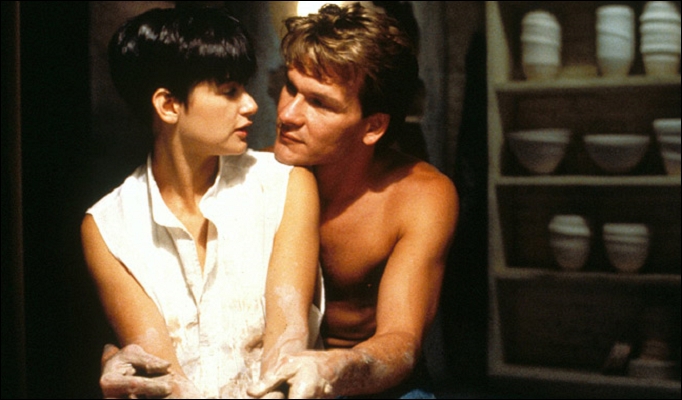
Locate an element on the screen. This screenshot has height=400, width=682. light is located at coordinates (303, 9).